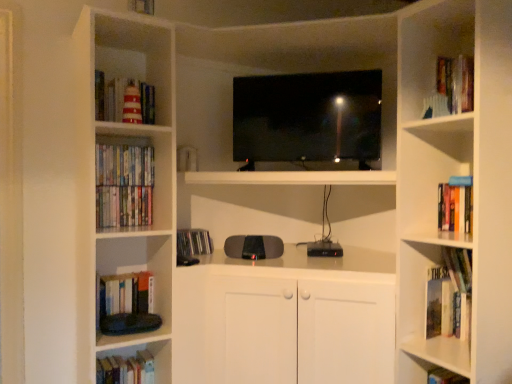
Identify the location of free spot above hardcover books at lower left, the 6th book viewed from the top (from a real-world perspective). Image resolution: width=512 pixels, height=384 pixels. (121, 360).